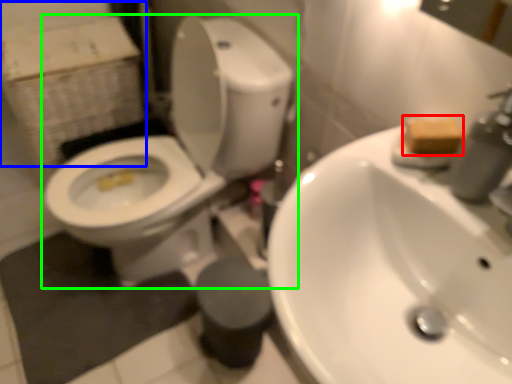
Question: Considering the real-world distances, which object is farthest from soap (highlighted by a red box)? cardboard box (highlighted by a blue box) or toilet (highlighted by a green box)?

Choices:
 (A) cardboard box
 (B) toilet

Answer: (A)